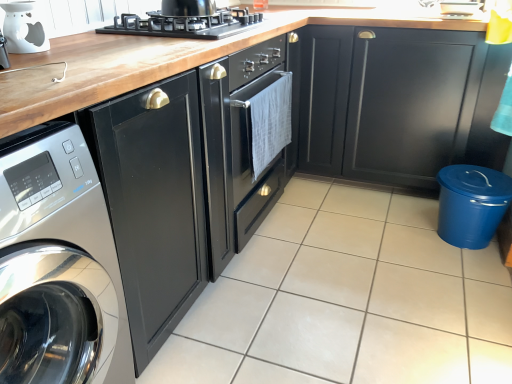
You are a GUI agent. You are given a task and a screenshot of the screen. Output one action in this format:
    pyautogui.click(x=<x>, y=<y>)
    Task: Click on the vacant space behind blue plastic trash can at lower right, positioned as the first appliance in bottom-to-top order
    This screenshot has width=512, height=384.
    Given the screenshot: What is the action you would take?
    pyautogui.click(x=410, y=204)